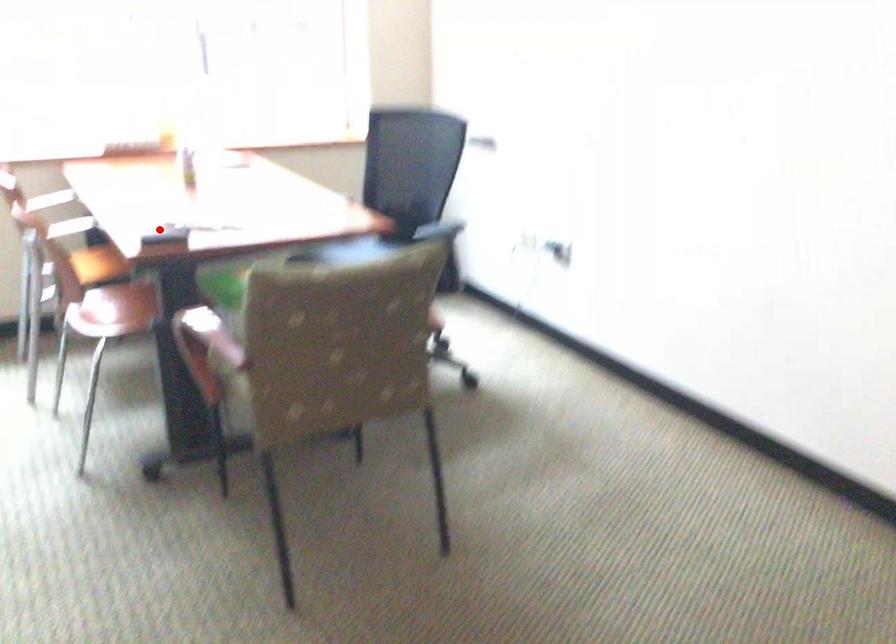
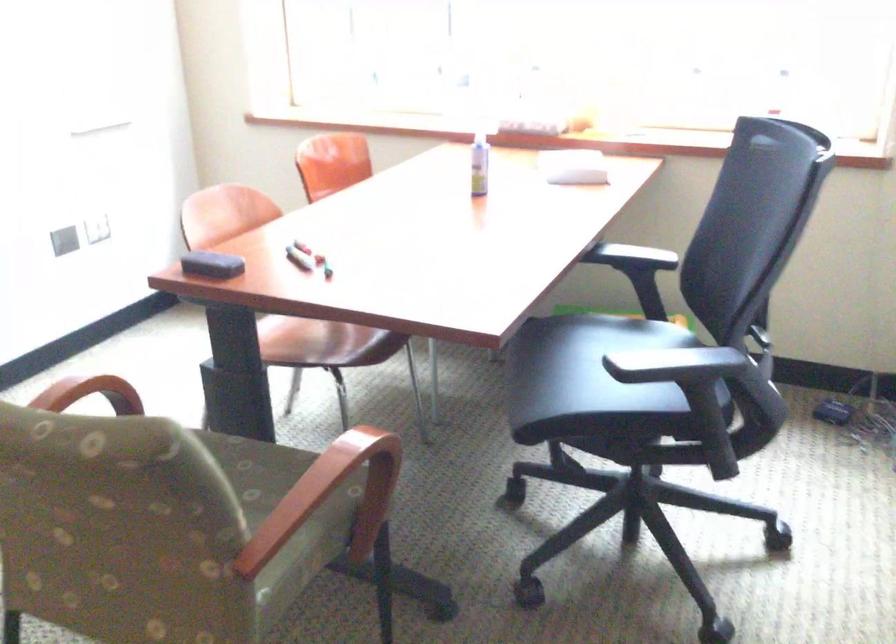
The point at the highlighted location is marked in the first image. Where is the corresponding point in the second image?

(211, 265)